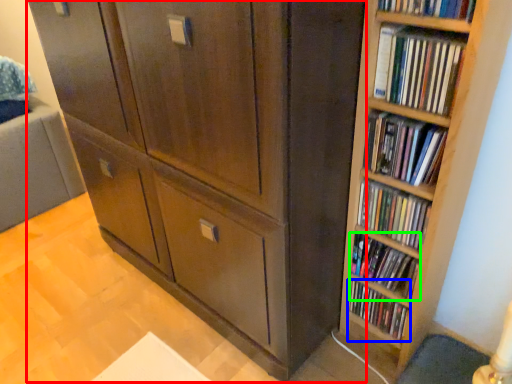
Question: Estimate the real-world distances between objects in this image. Which object is closer to cupboard (highlighted by a red box), book (highlighted by a blue box) or book (highlighted by a green box)?

Choices:
 (A) book
 (B) book

Answer: (B)